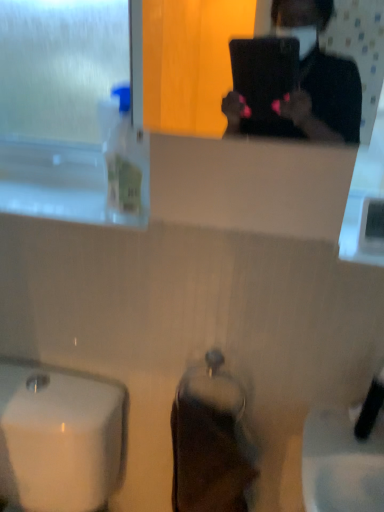
Question: Is frosted glass window screen at upper left at the left side of black matte laptop at upper center?

Choices:
 (A) yes
 (B) no

Answer: (A)

Question: From a real-world perspective, is frosted glass window screen at upper left located beneath black matte laptop at upper center?

Choices:
 (A) no
 (B) yes

Answer: (B)

Question: Does frosted glass window screen at upper left have a smaller size compared to black matte laptop at upper center?

Choices:
 (A) no
 (B) yes

Answer: (A)

Question: From a real-world perspective, is frosted glass window screen at upper left physically above black matte laptop at upper center?

Choices:
 (A) no
 (B) yes

Answer: (A)

Question: From the image's perspective, is frosted glass window screen at upper left located beneath black matte laptop at upper center?

Choices:
 (A) no
 (B) yes

Answer: (A)

Question: Is frosted glass window screen at upper left outside black matte laptop at upper center?

Choices:
 (A) no
 (B) yes

Answer: (B)

Question: Considering the relative sizes of clear plastic bottle at left and black matte laptop at upper center in the image provided, is clear plastic bottle at left shorter than black matte laptop at upper center?

Choices:
 (A) no
 (B) yes

Answer: (B)

Question: Is clear plastic bottle at left closer to camera compared to black matte laptop at upper center?

Choices:
 (A) yes
 (B) no

Answer: (B)

Question: Can you confirm if clear plastic bottle at left is positioned to the left of black matte laptop at upper center?

Choices:
 (A) yes
 (B) no

Answer: (A)

Question: Is clear plastic bottle at left looking in the opposite direction of black matte laptop at upper center?

Choices:
 (A) no
 (B) yes

Answer: (A)

Question: Is clear plastic bottle at left in contact with black matte laptop at upper center?

Choices:
 (A) no
 (B) yes

Answer: (A)

Question: From a real-world perspective, is clear plastic bottle at left physically below black matte laptop at upper center?

Choices:
 (A) yes
 (B) no

Answer: (A)

Question: Does clear plastic bottle at left appear on the left side of frosted glass window screen at upper left?

Choices:
 (A) yes
 (B) no

Answer: (B)